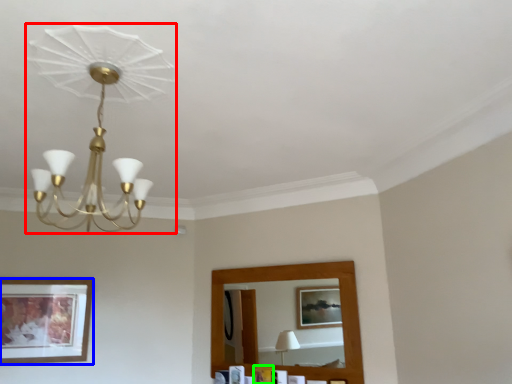
Question: Which is farther away from lamp (highlighted by a red box)? picture frame (highlighted by a blue box) or picture frame (highlighted by a green box)?

Choices:
 (A) picture frame
 (B) picture frame

Answer: (B)